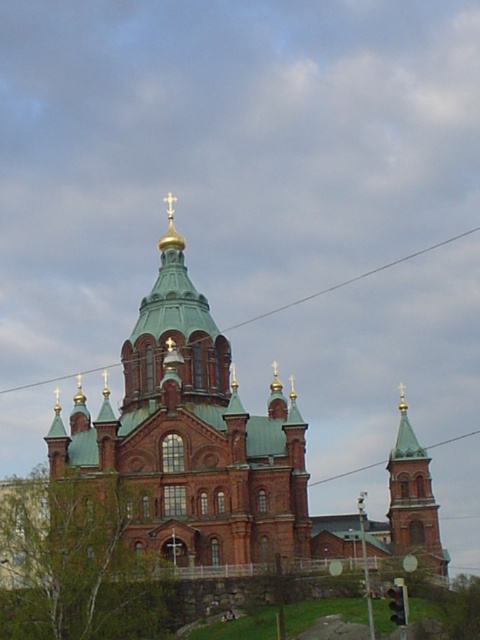
Question: Is green copper dome at center wider than green glass tower at upper center?

Choices:
 (A) no
 (B) yes

Answer: (B)

Question: Which point is farther from the camera taking this photo?

Choices:
 (A) (279, 528)
 (B) (432, 531)

Answer: (B)

Question: Which of the following is the farthest from the observer?

Choices:
 (A) (407, 493)
 (B) (217, 496)

Answer: (A)

Question: Among these objects, which one is nearest to the camera?

Choices:
 (A) green copper dome at center
 (B) green glass tower at upper center

Answer: (A)

Question: Can you confirm if green copper dome at center is positioned below green glass tower at upper center?

Choices:
 (A) no
 (B) yes

Answer: (A)

Question: Can you confirm if green copper dome at center is positioned below green glass tower at upper center?

Choices:
 (A) no
 (B) yes

Answer: (A)